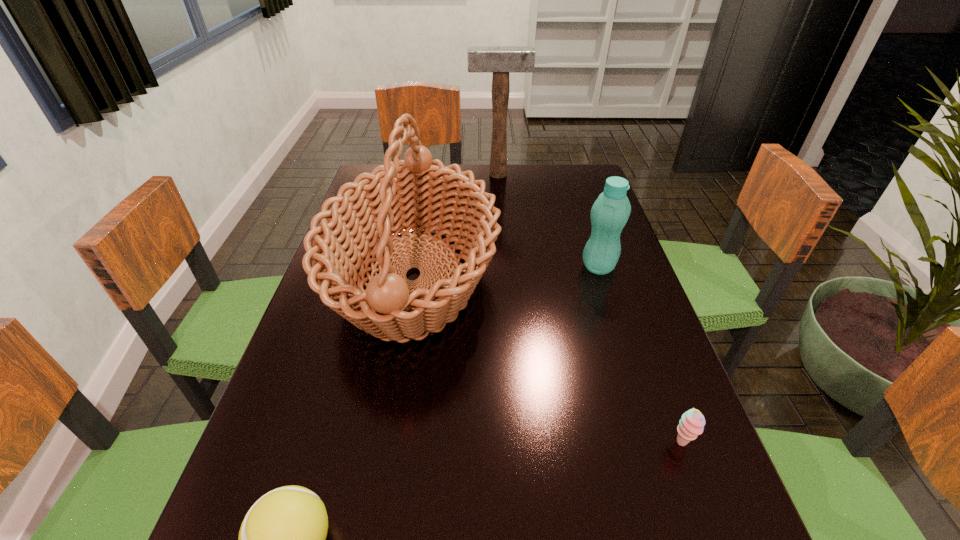
Locate an element on the screen. mallet is located at coordinates (500, 60).

Image resolution: width=960 pixels, height=540 pixels. I want to click on basket, so click(x=392, y=199).

Where is `bottle`? The width and height of the screenshot is (960, 540). bottle is located at coordinates (610, 212).

Find the location of a particular element. The width and height of the screenshot is (960, 540). the fourth farthest object is located at coordinates (692, 422).

In order to click on the shortest object in this screenshot , I will do `click(692, 422)`.

The image size is (960, 540). Identify the location of vacant space located on the right of the mallet. (574, 174).

Identify the location of free spot located on the front of the basket. This screenshot has width=960, height=540. (391, 413).

This screenshot has width=960, height=540. Identify the location of vacant area located 0.370m on the front of the third shortest object. (646, 416).

What are the coordinates of `free space located on the left of the sherbert` in the screenshot? It's located at (433, 443).

I want to click on object that is at the far edge, so click(x=500, y=60).